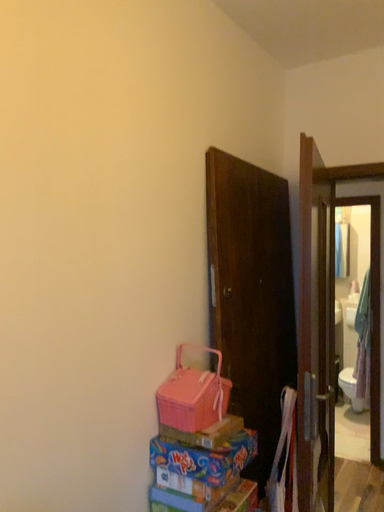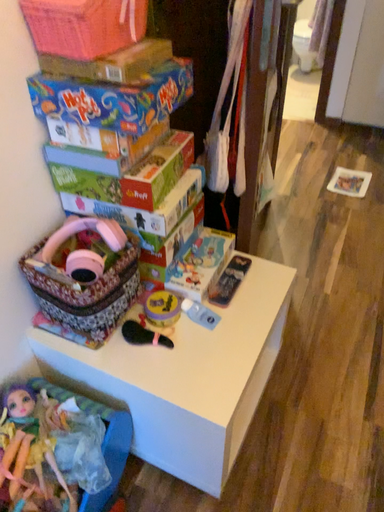
Question: How did the camera likely rotate when shooting the video?

Choices:
 (A) rotated right
 (B) rotated left

Answer: (A)